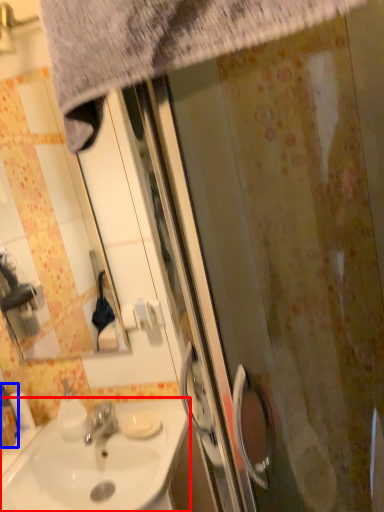
Question: Among these objects, which one is farthest to the camera, sink (highlighted by a red box) or bottle (highlighted by a blue box)?

Choices:
 (A) sink
 (B) bottle

Answer: (B)